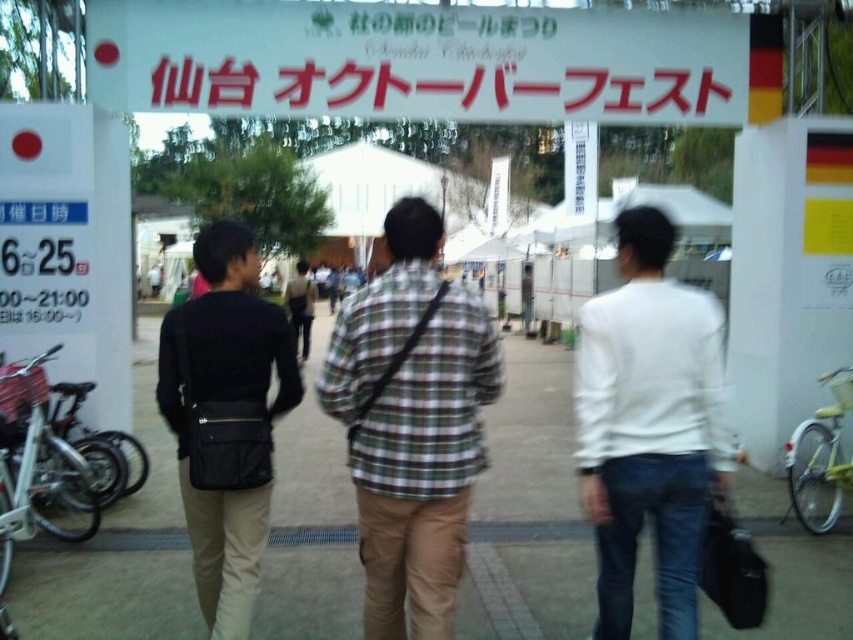
You are a photographer at the Sendai Oktoberfest event entrance. You want to take a photo of the white matte shirt at center and the black leather bag at center. Which object should you focus on first if you want to capture both in the frame?

The white matte shirt at center is positioned on the right side of black leather bag at center, so you should focus on the black leather bag at center first to ensure both are in the frame.

You are standing at the entrance of the Sendai Oktoberfest and see the white paper sign at upper center and the black leather bag at center. Which object is closer to you?

The white paper sign at upper center is closer to you because it is further to the viewer than the black leather bag at center.